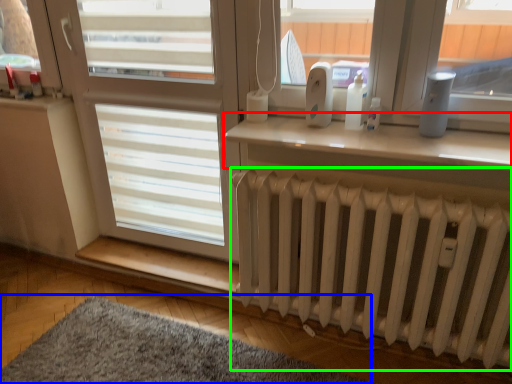
Question: Based on their relative distances, which object is farther from window (highlighted by a red box)? Choose from mat (highlighted by a blue box) and radiator (highlighted by a green box).

Choices:
 (A) mat
 (B) radiator

Answer: (A)